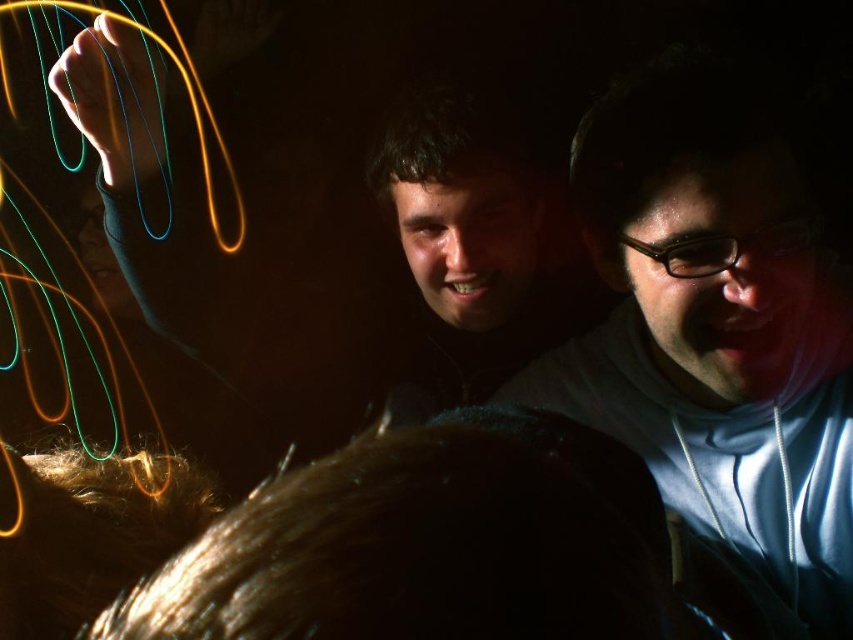
Is matte white hoodie at center right smaller than matte black face at center?

No, matte white hoodie at center right is not smaller than matte black face at center.

Can you confirm if matte white hoodie at center right is positioned to the left of matte black face at center?

In fact, matte white hoodie at center right is to the right of matte black face at center.

This screenshot has width=853, height=640. In order to click on matte white hoodie at center right in this screenshot , I will do `click(714, 323)`.

Find the location of `matte white hoodie at center right`. matte white hoodie at center right is located at coordinates (714, 323).